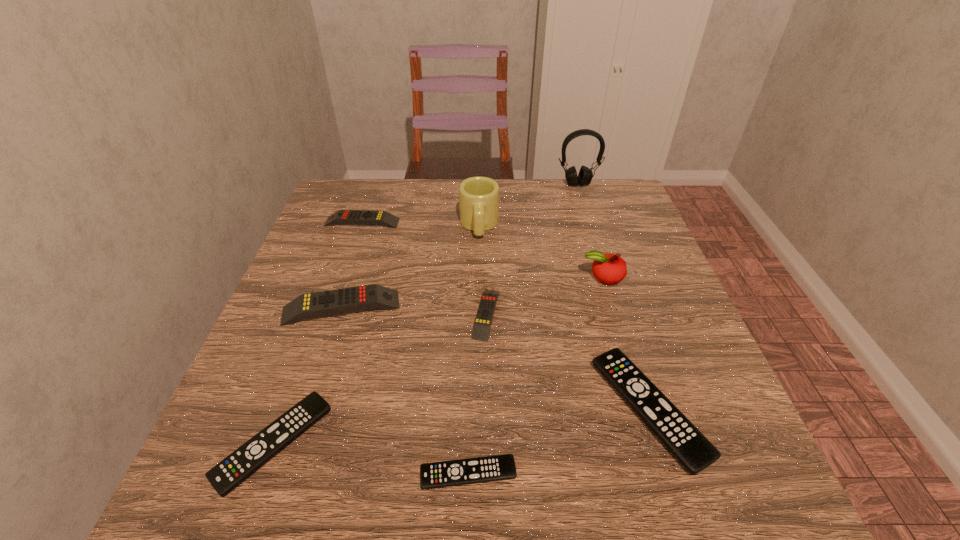
The image size is (960, 540). Find the location of `headset`. headset is located at coordinates (585, 175).

Identify the location of the farthest object. (585, 175).

Locate an element on the screen. mug is located at coordinates (478, 196).

I want to click on beige mug, so click(478, 196).

Find the location of `the fourth farthest object`. the fourth farthest object is located at coordinates coord(608,268).

You are a GUI agent. You are given a task and a screenshot of the screen. Output one action in this format:
    pyautogui.click(x=<x>, y=<y>)
    Task: Click on the third tallest object
    Image resolution: width=960 pixels, height=540 pixels.
    Given the screenshot: What is the action you would take?
    pyautogui.click(x=608, y=268)

The width and height of the screenshot is (960, 540). In order to click on the biggest yellow remote control in this screenshot , I will do `click(310, 305)`.

The height and width of the screenshot is (540, 960). What are the coordinates of `the sixth shortest object` in the screenshot? It's located at (310, 305).

The image size is (960, 540). Find the location of `the farthest remote control`. the farthest remote control is located at coordinates (357, 217).

This screenshot has height=540, width=960. I want to click on the second smallest yellow remote control, so click(x=357, y=217).